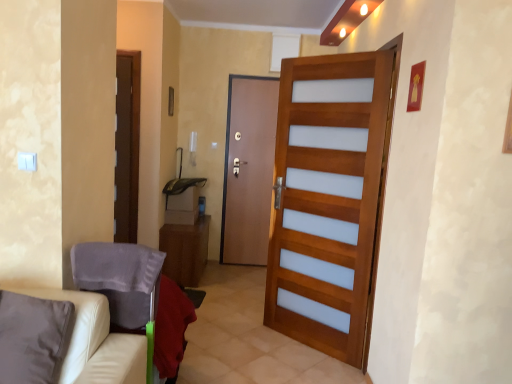
Question: Can you confirm if beige leather couch at lower left is thinner than white leather armchair at lower left?

Choices:
 (A) yes
 (B) no

Answer: (A)

Question: Is beige leather couch at lower left next to white leather armchair at lower left and touching it?

Choices:
 (A) no
 (B) yes

Answer: (A)

Question: Is beige leather couch at lower left closer to the viewer compared to white leather armchair at lower left?

Choices:
 (A) no
 (B) yes

Answer: (B)

Question: Does beige leather couch at lower left have a larger size compared to white leather armchair at lower left?

Choices:
 (A) yes
 (B) no

Answer: (B)

Question: Is beige leather couch at lower left to the left of white leather armchair at lower left from the viewer's perspective?

Choices:
 (A) yes
 (B) no

Answer: (A)

Question: Is wooden door at center, the second door in the left-to-right sequence, bigger or smaller than wooden cabinet at center?

Choices:
 (A) small
 (B) big

Answer: (B)

Question: Is point (345, 309) closer or farther from the camera than point (181, 236)?

Choices:
 (A) closer
 (B) farther

Answer: (A)

Question: Choose the correct answer: Is wooden door at center, the second door from the back, inside wooden cabinet at center or outside it?

Choices:
 (A) inside
 (B) outside

Answer: (B)

Question: From a real-world perspective, relative to wooden cabinet at center, is wooden door at center, the second door from the back, vertically above or below?

Choices:
 (A) below
 (B) above

Answer: (B)

Question: Is wooden door at center, the second door in the left-to-right sequence, wider or thinner than white leather armchair at lower left?

Choices:
 (A) wide
 (B) thin

Answer: (B)

Question: In the image, is wooden door at center, which appears as the 1th door when viewed from the right, on the left side or the right side of white leather armchair at lower left?

Choices:
 (A) right
 (B) left

Answer: (A)

Question: From a real-world perspective, relative to white leather armchair at lower left, is wooden door at center, which appears as the 1th door when viewed from the right, vertically above or below?

Choices:
 (A) below
 (B) above

Answer: (B)

Question: In the image, is wooden door at center, the first door from the front, positioned in front of or behind white leather armchair at lower left?

Choices:
 (A) behind
 (B) front

Answer: (A)

Question: Considering the positions of point (80, 248) and point (82, 296), is point (80, 248) closer or farther from the camera than point (82, 296)?

Choices:
 (A) farther
 (B) closer

Answer: (A)

Question: Based on their sizes in the image, would you say white leather armchair at lower left is bigger or smaller than beige leather couch at lower left?

Choices:
 (A) big
 (B) small

Answer: (A)